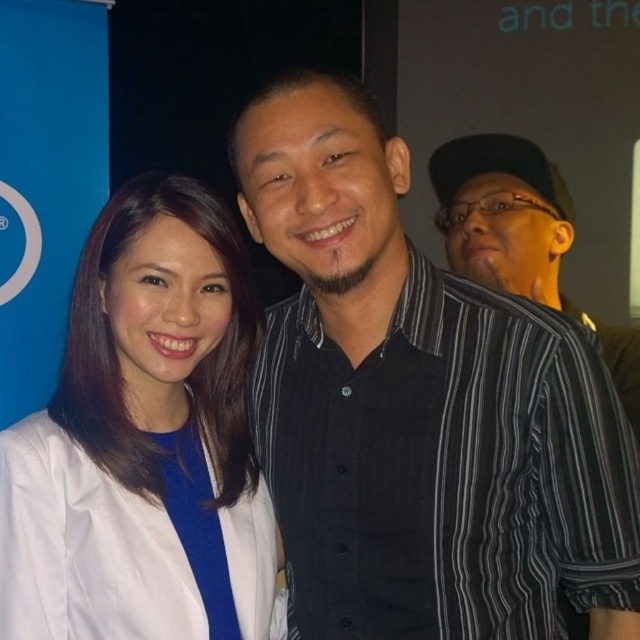
Is white matte coat at left to the right of black striped shirt at right from the viewer's perspective?

Incorrect, white matte coat at left is not on the right side of black striped shirt at right.

Who is positioned more to the left, white matte coat at left or black striped shirt at right?

Positioned to the left is white matte coat at left.

Is point (44, 483) more distant than point (628, 397)?

No, it is in front of (628, 397).

I want to click on white matte coat at left, so click(141, 442).

How distant is black striped shirt at center from black striped shirt at right?

black striped shirt at center and black striped shirt at right are 29.75 inches apart.

Does black striped shirt at center have a greater height compared to black striped shirt at right?

Yes, black striped shirt at center is taller than black striped shirt at right.

Who is more forward, (x=410, y=387) or (x=509, y=241)?

Positioned in front is point (x=410, y=387).

Locate an element on the screen. This screenshot has width=640, height=640. black striped shirt at center is located at coordinates (420, 410).

Can you confirm if black striped shirt at center is positioned above white matte coat at left?

Correct, black striped shirt at center is located above white matte coat at left.

Does point (461, 378) come farther from viewer compared to point (192, 612)?

No, it is in front of (192, 612).

Identify the location of black striped shirt at center. (420, 410).